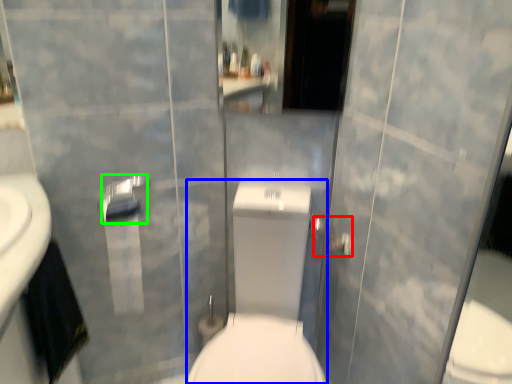
Question: Which is farther away from shower (highlighted by a red box)? sit (highlighted by a blue box) or towel bar (highlighted by a green box)?

Choices:
 (A) sit
 (B) towel bar

Answer: (B)